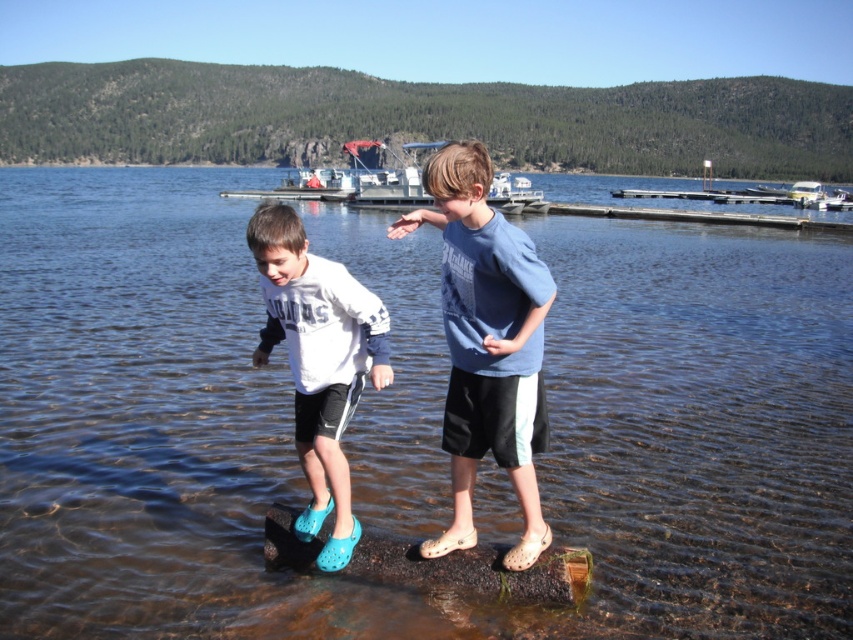
Question: Does brown rubber log at lower center have a larger size compared to white plastic boat at upper right?

Choices:
 (A) yes
 (B) no

Answer: (B)

Question: Which of these objects is positioned closest to the white matte sneakers at center?

Choices:
 (A) brown rubber log at lower center
 (B) white plastic boat at center
 (C) white plastic boat at upper right

Answer: (A)

Question: In this image, where is white matte sneakers at center located relative to brown rubber log at lower center?

Choices:
 (A) above
 (B) below

Answer: (A)

Question: Is clear water at center closer to camera compared to brown rubber log at lower center?

Choices:
 (A) no
 (B) yes

Answer: (A)

Question: Which object appears farthest from the camera in this image?

Choices:
 (A) white plastic boat at upper right
 (B) brown rubber log at lower center

Answer: (A)

Question: Among these points, which one is farthest from the camera?

Choices:
 (A) coord(527,259)
 (B) coord(836,557)
 (C) coord(817,186)

Answer: (C)